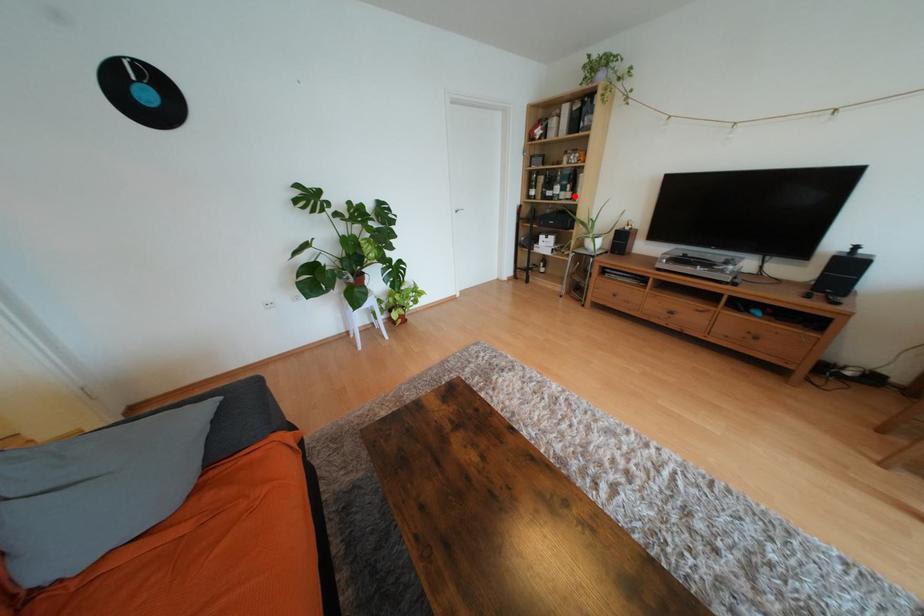
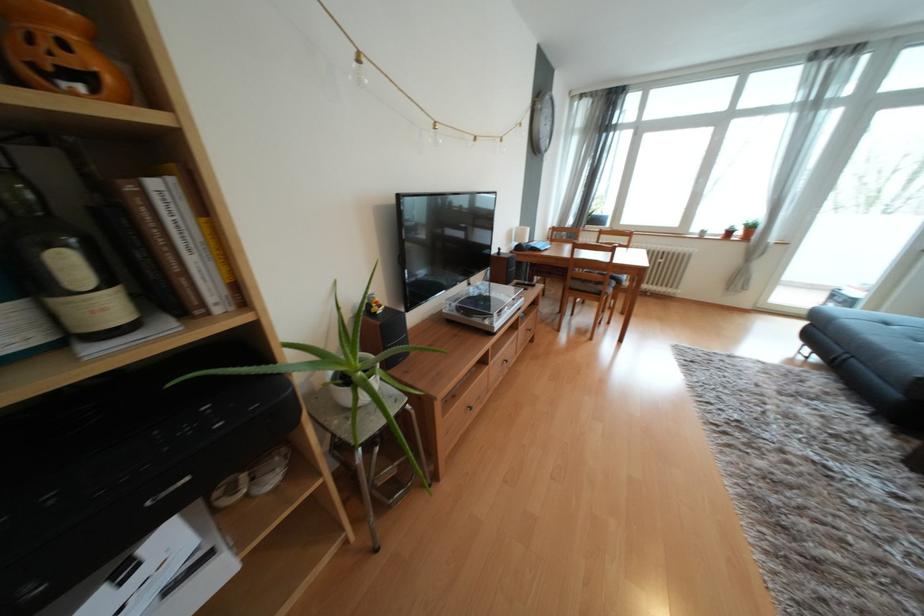
Question: I am providing you with two images of the same scene from different viewpoints. A red point is shown in image1. For the corresponding object point in image2, is it positioned nearer or farther from the camera?

Choices:
 (A) Nearer
 (B) Farther

Answer: (B)